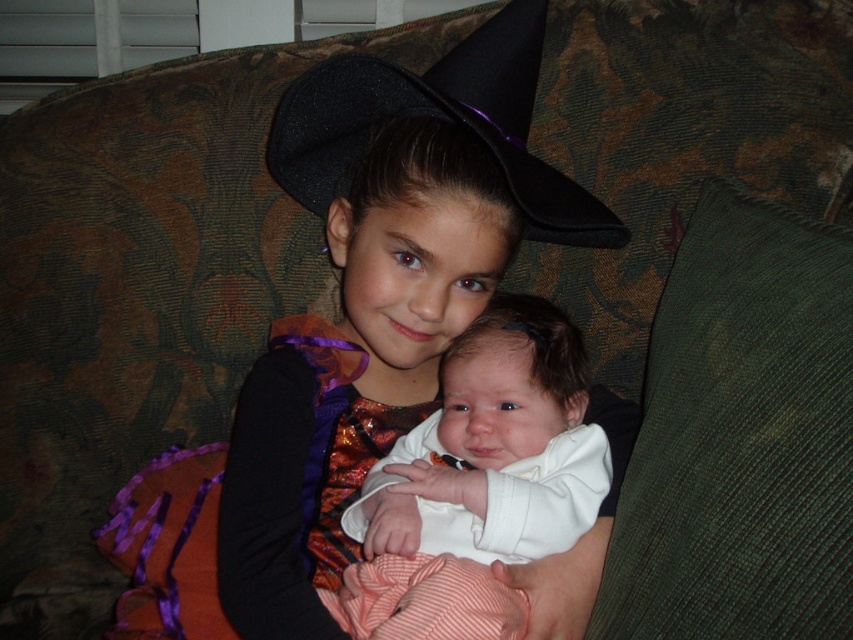
Is white soft baby at center bigger than black felt witch hat at upper center?

Yes.

Is white soft baby at center positioned at the back of black felt witch hat at upper center?

That is False.

Between point (418, 541) and point (274, 125), which one is positioned in front?

Positioned in front is point (418, 541).

I want to click on white soft baby at center, so click(x=480, y=476).